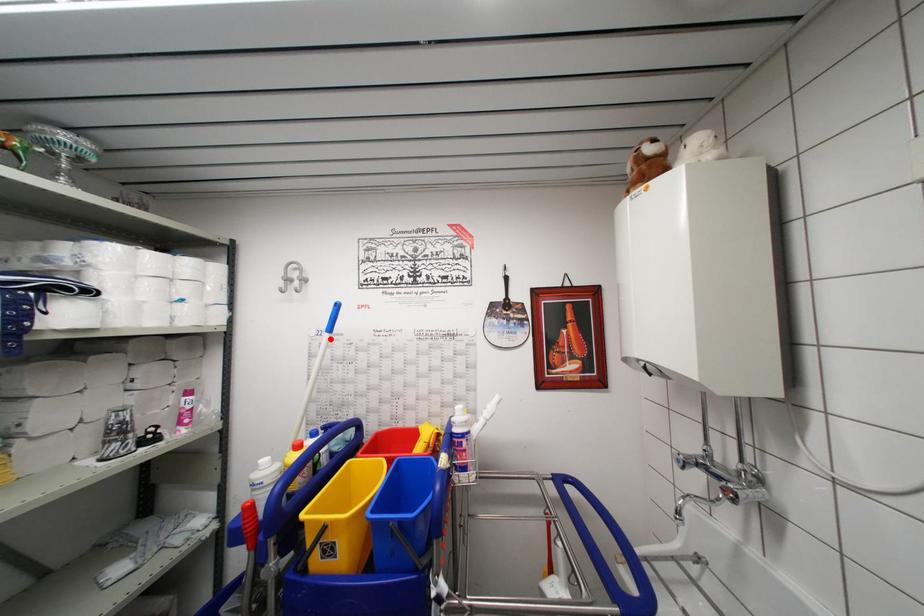
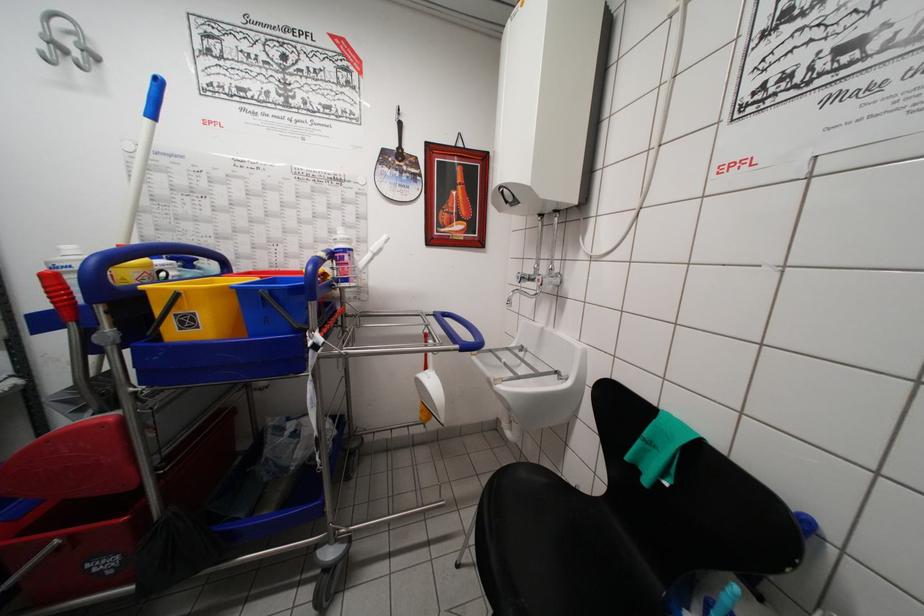
The point at the highlighted location is marked in the first image. Where is the corresponding point in the second image?

(151, 124)